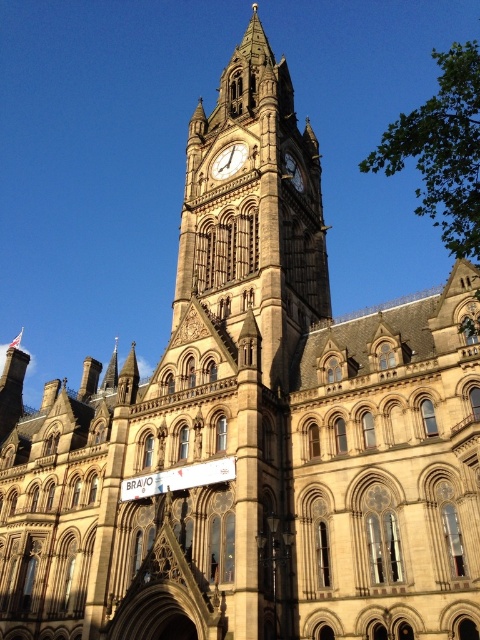
Can you confirm if brown stone clock tower at center is smaller than gold textured clock at center?

No.

Based on the photo, can you confirm if brown stone clock tower at center is positioned to the left of gold textured clock at center?

No, brown stone clock tower at center is not to the left of gold textured clock at center.

Between point (233, 310) and point (219, 161), which one is positioned in front?

Point (233, 310) is more forward.

Locate an element on the screen. brown stone clock tower at center is located at coordinates (254, 211).